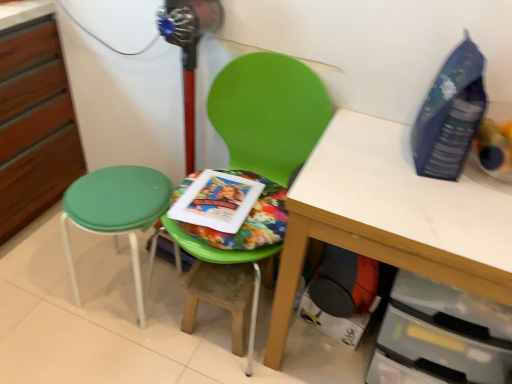
Question: From the image's perspective, is wooden step stool at center located above or below green fabric stool at left?

Choices:
 (A) above
 (B) below

Answer: (B)

Question: From a real-world perspective, is wooden step stool at center physically located above or below green fabric stool at left?

Choices:
 (A) below
 (B) above

Answer: (A)

Question: Estimate the real-world distances between objects in this image. Which object is farther from the green fabric stool at left?

Choices:
 (A) wooden step stool at center
 (B) blue plastic bottle at upper right
 (C) green plastic chair at center
 (D) multicolored fabric paperback book at center
 (E) white matte table at center

Answer: (B)

Question: Considering the real-world distances, which object is closest to the green fabric stool at left?

Choices:
 (A) white matte table at center
 (B) blue plastic bottle at upper right
 (C) green plastic chair at center
 (D) wooden step stool at center
 (E) multicolored fabric paperback book at center

Answer: (E)